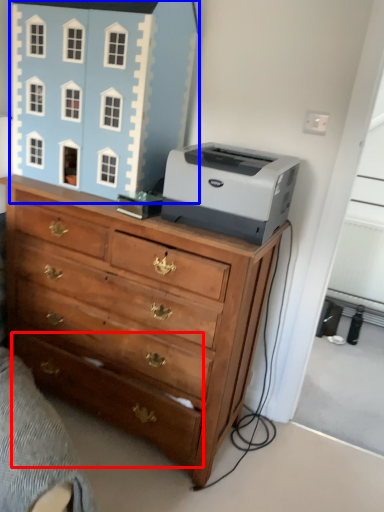
Question: Which of the following is the closest to the observer, drawer (highlighted by a red box) or toy (highlighted by a blue box)?

Choices:
 (A) drawer
 (B) toy

Answer: (A)